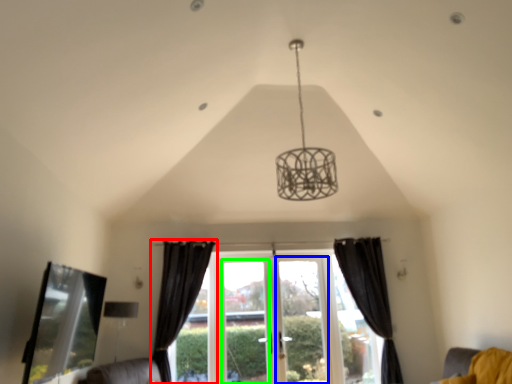
Question: Estimate the real-world distances between objects in this image. Which object is farther from curtain (highlighted by a red box), screen door (highlighted by a blue box) or window frame (highlighted by a green box)?

Choices:
 (A) screen door
 (B) window frame

Answer: (A)